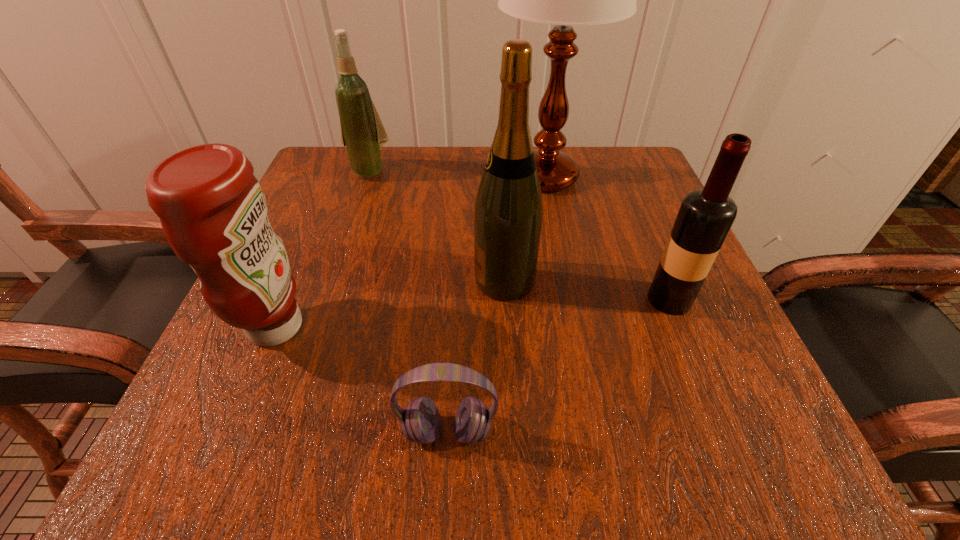
I want to click on the second closest object to the tallest object, so click(705, 217).

You are a GUI agent. You are given a task and a screenshot of the screen. Output one action in this format:
    pyautogui.click(x=<x>, y=<y>)
    Task: Click on the third closest wine bottle to the shortest object
    This screenshot has height=540, width=960.
    Given the screenshot: What is the action you would take?
    pyautogui.click(x=362, y=132)

In order to click on wine bottle identified as the closest to the farthest wine bottle in this screenshot , I will do `click(508, 214)`.

You are a GUI agent. You are given a task and a screenshot of the screen. Output one action in this format:
    pyautogui.click(x=<x>, y=<y>)
    Task: Click on the free spot that satisfies the following two spatial constraints: 1. on the front-facing side of the fifth shortest object; 2. on the headband and ear cups of the headset
    
    Given the screenshot: What is the action you would take?
    pyautogui.click(x=514, y=431)

What are the coordinates of `vacant area in the image that satisfies the following two spatial constraints: 1. on the front-facing side of the second wine bottle from right to left; 2. on the headband and ear cups of the shortest object` in the screenshot? It's located at (514, 431).

At what (x,y) coordinates should I click in order to perform the action: click on vacant region that satisfies the following two spatial constraints: 1. on the front-facing side of the leftmost wine bottle; 2. on the left side of the rightmost wine bottle. Please return your answer as a coordinate pair (x, y). Image resolution: width=960 pixels, height=540 pixels. Looking at the image, I should click on (326, 299).

Image resolution: width=960 pixels, height=540 pixels. What are the coordinates of `vacant position in the image that satisfies the following two spatial constraints: 1. on the front-facing side of the rightmost object; 2. on the left side of the second tallest object` in the screenshot? It's located at (506, 299).

Locate an element on the screen. This screenshot has width=960, height=540. free space that satisfies the following two spatial constraints: 1. on the front-facing side of the rightmost object; 2. on the left side of the leftmost wine bottle is located at coordinates (326, 299).